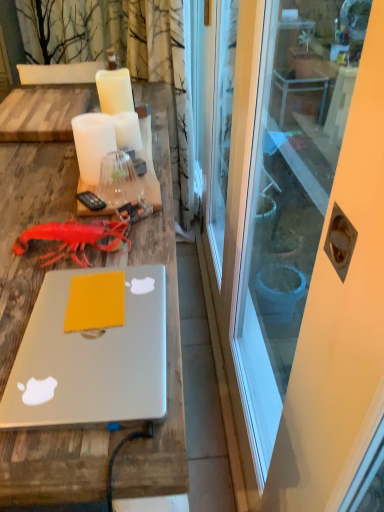
Question: Which direction should I rotate to face white matte candle at center, acting as the first candle starting from the back, — up or down?

Choices:
 (A) up
 (B) down

Answer: (A)

Question: Should I look upward or downward to see yellow matte notepad at center?

Choices:
 (A) up
 (B) down

Answer: (B)

Question: Is the position of rubber matte lobster at center less distant than that of white glossy screen door at center?

Choices:
 (A) no
 (B) yes

Answer: (A)

Question: Is the depth of rubber matte lobster at center greater than that of white glossy screen door at center?

Choices:
 (A) yes
 (B) no

Answer: (A)

Question: From a real-world perspective, is rubber matte lobster at center positioned over white glossy screen door at center based on gravity?

Choices:
 (A) no
 (B) yes

Answer: (B)

Question: Is white glossy screen door at center completely or partially inside rubber matte lobster at center?

Choices:
 (A) no
 (B) yes

Answer: (A)

Question: Does rubber matte lobster at center have a lesser height compared to white glossy screen door at center?

Choices:
 (A) no
 (B) yes

Answer: (B)

Question: Is rubber matte lobster at center at the left side of white glossy screen door at center?

Choices:
 (A) no
 (B) yes

Answer: (B)

Question: Considering the relative sizes of yellow matte notepad at center and white matte candle at center, which appears as the 2th candle when viewed from the front, in the image provided, is yellow matte notepad at center smaller than white matte candle at center, which appears as the 2th candle when viewed from the front,?

Choices:
 (A) no
 (B) yes

Answer: (B)

Question: Is yellow matte notepad at center facing away from white matte candle at center, acting as the second candle starting from the back?

Choices:
 (A) no
 (B) yes

Answer: (A)

Question: From the image's perspective, is yellow matte notepad at center over white matte candle at center, which appears as the 2th candle when viewed from the front?

Choices:
 (A) yes
 (B) no

Answer: (B)

Question: Is yellow matte notepad at center positioned before white matte candle at center, which appears as the 2th candle when viewed from the front?

Choices:
 (A) no
 (B) yes

Answer: (B)

Question: Is yellow matte notepad at center at the left side of white matte candle at center, acting as the second candle starting from the back?

Choices:
 (A) yes
 (B) no

Answer: (B)

Question: Is yellow matte notepad at center thinner than white matte candle at center, which appears as the 2th candle when viewed from the front?

Choices:
 (A) yes
 (B) no

Answer: (A)

Question: Is white matte candle at center, marked as the third candle in a front-to-back arrangement, located outside white matte candle at upper center, the 1th candle when ordered from front to back?

Choices:
 (A) yes
 (B) no

Answer: (A)